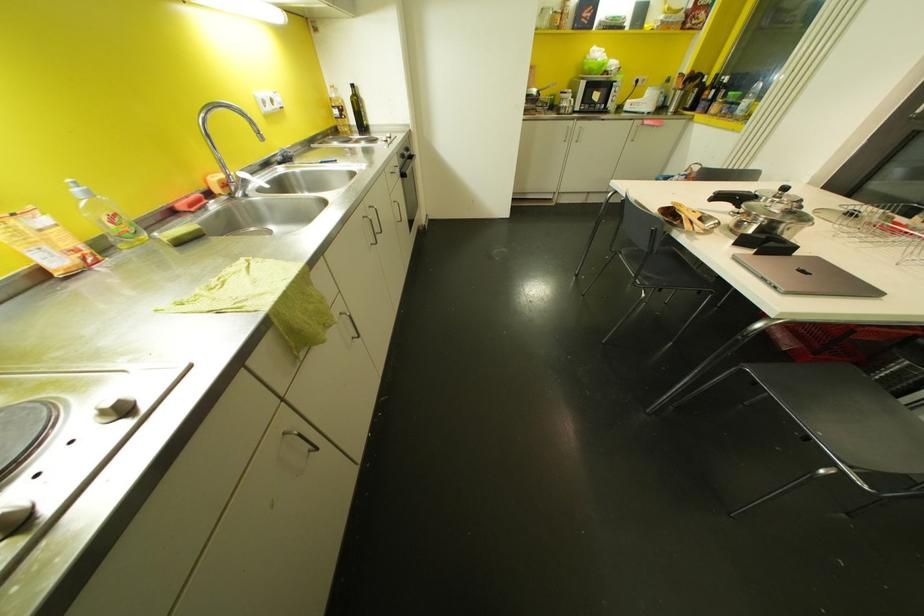
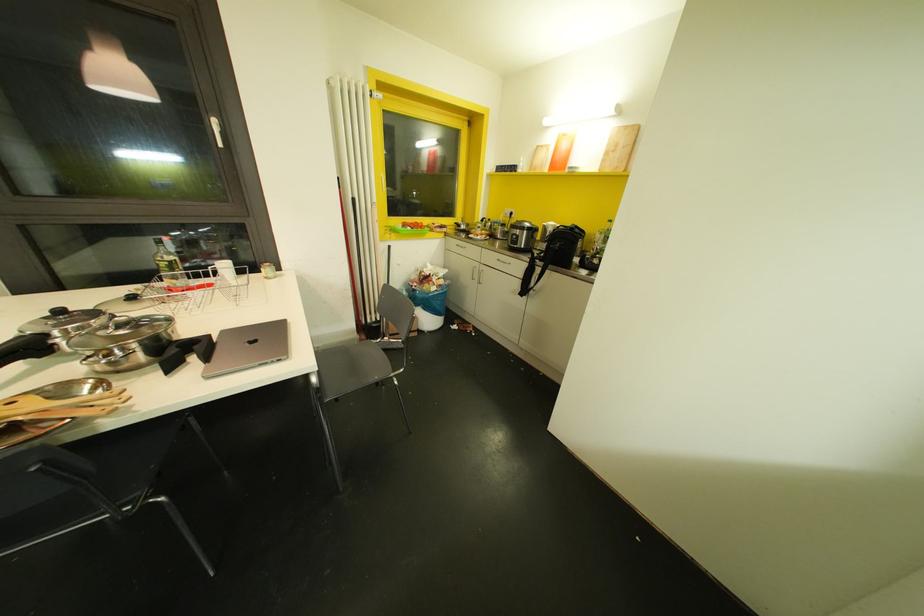
In the second image, find the point that corresponds to the point at 815,257 in the first image.

(223, 331)